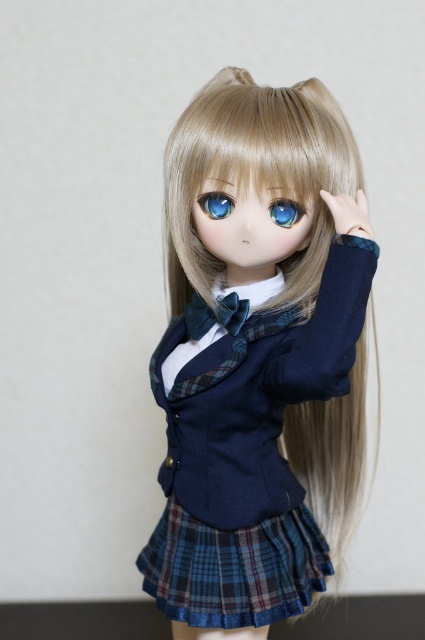
You are a photographer taking a picture of the doll. The camera is positioned at a certain distance. If the blonde silky hair at center is the main focus, will the camera need to be moved closer or farther away to ensure the entire doll is in focus?

The camera is 35.42 inches away from the blonde silky hair at center. To ensure the entire doll is in focus, the photographer should move the camera farther away so that the entire doll fits within the depth of field.

Looking at the doll in its school uniform, which object is bigger between the blonde silky hair at center and the blue glossy eye at upper center?

The blonde silky hair at center is larger in size compared to the blue glossy eye at upper center.